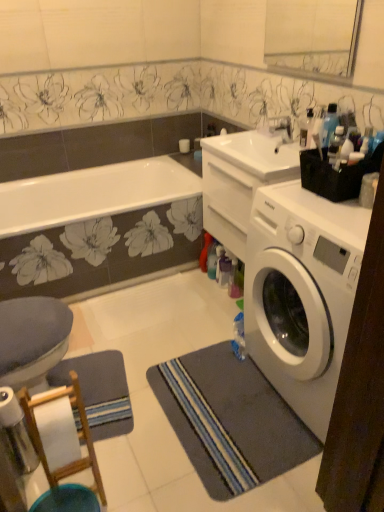
Question: From a real-world perspective, is clear glass mirror at upper center physically located above or below transparent plastic bottle at upper right, which is counted as the first bottle, starting from the back?

Choices:
 (A) above
 (B) below

Answer: (A)

Question: From the image's perspective, relative to transparent plastic bottle at upper right, which is counted as the first bottle, starting from the back, is clear glass mirror at upper center above or below?

Choices:
 (A) below
 (B) above

Answer: (B)

Question: Which of these objects is positioned farthest from the transparent plastic bottle at upper right, marked as the 2th bottle in a bottom-to-top arrangement?

Choices:
 (A) white wood bar stool at lower left
 (B) blue fabric toilet at lower left
 (C) gray striped bath mat at lower right
 (D) white glossy sink at upper center
 (E) clear glass mirror at upper center

Answer: (E)

Question: Estimate the real-world distances between objects in this image. Which object is closer to the gray striped bath mat at lower right?

Choices:
 (A) translucent plastic bottle at upper right, placed as the second bottle when sorted from top to bottom
 (B) clear glass mirror at upper center
 (C) blue striped yoga mat at lower left
 (D) blue fabric toilet at lower left
 (E) white wood bar stool at lower left

Answer: (C)